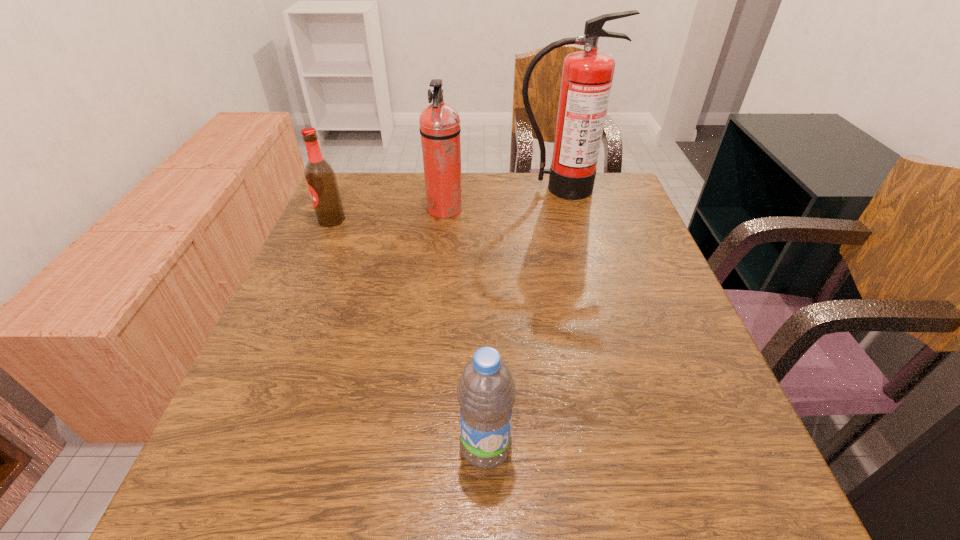
Image resolution: width=960 pixels, height=540 pixels. Identify the location of object that is the closest to the right fire extinguisher. (440, 129).

Select which object appears as the third closest to the second object from right to left. Please provide its 2D coordinates. Your answer should be formatted as a tuple, i.e. [(x, y)], where the tuple contains the x and y coordinates of a point satisfying the conditions above.

[(587, 75)]

At what (x,y) coordinates should I click in order to perform the action: click on vacant space that satisfies the following two spatial constraints: 1. on the front-facing side of the taller fire extinguisher; 2. at the nozzle of the third shortest object. Please return your answer as a coordinate pair (x, y). Looking at the image, I should click on (564, 210).

I want to click on vacant space that satisfies the following two spatial constraints: 1. on the front-facing side of the tallest object; 2. at the nozzle of the shorter fire extinguisher, so coord(564,210).

Where is `free spot that satisfies the following two spatial constraints: 1. at the nozzle of the shorter fire extinguisher; 2. on the back side of the second object from right to left`? The height and width of the screenshot is (540, 960). free spot that satisfies the following two spatial constraints: 1. at the nozzle of the shorter fire extinguisher; 2. on the back side of the second object from right to left is located at coordinates (420, 448).

You are a GUI agent. You are given a task and a screenshot of the screen. Output one action in this format:
    pyautogui.click(x=<x>, y=<y>)
    Task: Click on the free space that satisfies the following two spatial constraints: 1. at the nozzle of the third object from right to left; 2. on the back side of the nearest object
    
    Given the screenshot: What is the action you would take?
    pyautogui.click(x=420, y=448)

At what (x,y) coordinates should I click in order to perform the action: click on free space that satisfies the following two spatial constraints: 1. at the nozzle of the second tallest object; 2. on the right side of the nearest object. Please return your answer as a coordinate pair (x, y). This screenshot has height=540, width=960. Looking at the image, I should click on (420, 448).

The width and height of the screenshot is (960, 540). In order to click on vacant area in the image that satisfies the following two spatial constraints: 1. on the front-facing side of the tallest object; 2. at the nozzle of the second object from left to right in this screenshot , I will do `click(564, 210)`.

The width and height of the screenshot is (960, 540). I want to click on vacant space that satisfies the following two spatial constraints: 1. on the front-facing side of the rightmost object; 2. at the nozzle of the shorter fire extinguisher, so click(564, 210).

Where is `vacant space that satisfies the following two spatial constraints: 1. at the nozzle of the nearest object; 2. on the right side of the left fire extinguisher`? This screenshot has width=960, height=540. vacant space that satisfies the following two spatial constraints: 1. at the nozzle of the nearest object; 2. on the right side of the left fire extinguisher is located at coordinates pos(420,448).